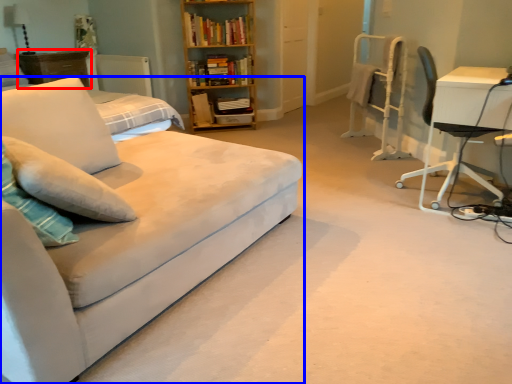
Question: Which of the following is the closest to the observer, dresser (highlighted by a red box) or studio couch (highlighted by a blue box)?

Choices:
 (A) dresser
 (B) studio couch

Answer: (B)